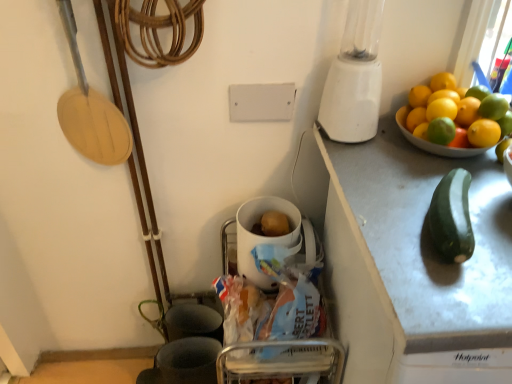
What are the coordinates of `yellow matte lemon at upper right, the fourth lemon when ordered from top to bottom` in the screenshot? It's located at (441, 109).

How much space does green matte lemon at upper right, which appears as the 1th lemon when ordered from the bottom, occupy vertically?

green matte lemon at upper right, which appears as the 1th lemon when ordered from the bottom, is 1.82 inches in height.

The image size is (512, 384). I want to click on green matte lemon at upper right, which appears as the 1th lemon when ordered from the bottom, so click(441, 131).

At what (x,y) coordinates should I click in order to perform the action: click on yellow matte lemon at upper right, the fourth lemon when ordered from top to bottom. Please return your answer as a coordinate pair (x, y). Looking at the image, I should click on (441, 109).

Is wooden at left far from white glossy mug at center?

No.

This screenshot has height=384, width=512. I want to click on pot/pan lying above the white glossy mug at center (from the image's perspective), so click(x=90, y=110).

Does wooden at left turn towards white glossy mug at center?

No, wooden at left is not oriented towards white glossy mug at center.

Would you consider yellow matte lemon at upper right, arranged as the first lemon when viewed from the top, to be distant from white plastic blender at upper right?

No, there isn't a large distance between yellow matte lemon at upper right, arranged as the first lemon when viewed from the top, and white plastic blender at upper right.

Between point (447, 82) and point (353, 57), which one is positioned behind?

The point (447, 82) is behind.

From the image's perspective, relative to white plastic blender at upper right, is yellow matte lemon at upper right, arranged as the first lemon when viewed from the top, above or below?

Based on their image positions, yellow matte lemon at upper right, arranged as the first lemon when viewed from the top, is located beneath white plastic blender at upper right.

In the image, there is a yellow matte lemon at upper right, the sixth lemon positioned from the bottom. Identify the location of blender above it (from the image's perspective). Image resolution: width=512 pixels, height=384 pixels. (354, 77).

Which is correct: yellow matte lemon at right, which is the fifth lemon from top to bottom, is inside yellow matte lemon at upper right, the fourth lemon when ordered from top to bottom, or outside of it?

yellow matte lemon at right, which is the fifth lemon from top to bottom, lies outside yellow matte lemon at upper right, the fourth lemon when ordered from top to bottom.

Is yellow matte lemon at right, the second lemon from the bottom, in front of or behind yellow matte lemon at upper right, the 3th lemon ordered from the bottom, in the image?

yellow matte lemon at right, the second lemon from the bottom, is in front of yellow matte lemon at upper right, the 3th lemon ordered from the bottom.

Based on their positions, is white plastic blender at upper right located to the left or right of yellow matte lemon at upper right, the 3th lemon viewed from the top?

Based on their positions, white plastic blender at upper right is located to the left of yellow matte lemon at upper right, the 3th lemon viewed from the top.

Is white plastic blender at upper right taller than yellow matte lemon at upper right, acting as the 4th lemon starting from the bottom?

Correct, white plastic blender at upper right is much taller as yellow matte lemon at upper right, acting as the 4th lemon starting from the bottom.

Is white plastic blender at upper right completely or partially outside of yellow matte lemon at upper right, acting as the 4th lemon starting from the bottom?

white plastic blender at upper right is positioned outside yellow matte lemon at upper right, acting as the 4th lemon starting from the bottom.

Between white plastic blender at upper right and yellow matte lemon at upper right, the 3th lemon viewed from the top, which one is positioned in front?

white plastic blender at upper right is more forward.

From a real-world perspective, which lemon is the 3rd one above the yellow matte lemon at right, the second lemon from the bottom? Please provide its 2D coordinates.

[(444, 95)]

Is the position of yellow matte lemon at upper right, which is the second lemon from top to bottom, less distant than that of yellow matte lemon at right, the second lemon from the bottom?

No, yellow matte lemon at upper right, which is the second lemon from top to bottom, is further to the viewer.

Could yellow matte lemon at right, the second lemon from the bottom, be considered to be inside yellow matte lemon at upper right, which is the second lemon from top to bottom?

Actually, yellow matte lemon at right, the second lemon from the bottom, is outside yellow matte lemon at upper right, which is the second lemon from top to bottom.

Between yellow matte lemon at upper right, which is the second lemon from top to bottom, and yellow matte lemon at right, the second lemon from the bottom, which one has smaller width?

With smaller width is yellow matte lemon at right, the second lemon from the bottom.

Does white plastic blender at upper right appear on the right side of white ceramic bowl at upper right?

Incorrect, white plastic blender at upper right is not on the right side of white ceramic bowl at upper right.

What's the angular difference between white plastic blender at upper right and white ceramic bowl at upper right's facing directions?

The angle between the facing direction of white plastic blender at upper right and the facing direction of white ceramic bowl at upper right is 0.879 degrees.

From the image's perspective, is white plastic blender at upper right on white ceramic bowl at upper right?

Correct, white plastic blender at upper right appears higher than white ceramic bowl at upper right in the image.

From a real-world perspective, between white plastic blender at upper right and white ceramic bowl at upper right, who is vertically lower?

white ceramic bowl at upper right.

Between green matte lemon at upper right, the 6th lemon viewed from the top, and white glossy mug at center, which one has larger size?

Bigger between the two is white glossy mug at center.

Which object is wider, green matte lemon at upper right, the 6th lemon viewed from the top, or white glossy mug at center?

white glossy mug at center is wider.

Locate an element on the screen. Image resolution: width=512 pixels, height=384 pixels. coffee cup behind the green matte lemon at upper right, which appears as the 1th lemon when ordered from the bottom is located at coordinates (264, 236).

From a real-world perspective, who is located higher, green matte lemon at upper right, the 6th lemon viewed from the top, or white glossy mug at center?

In real-world perspective, green matte lemon at upper right, the 6th lemon viewed from the top, is above.

Where is `pot/pan located above the white glossy mug at center (from the image's perspective)`? This screenshot has height=384, width=512. pot/pan located above the white glossy mug at center (from the image's perspective) is located at coordinates (90, 110).

This screenshot has height=384, width=512. Identify the location of blender on the left of the yellow matte lemon at upper right, arranged as the first lemon when viewed from the top. (354, 77).

Based on their spatial positions, is orange matte at upper right or green matte zucchini at right further from green matte lemon at upper right, the 6th lemon viewed from the top?

orange matte at upper right lies further to green matte lemon at upper right, the 6th lemon viewed from the top, than the other object.

When comparing their distances from orange matte at upper right, does green matte zucchini at right or yellow matte lemon at upper right, the sixth lemon positioned from the bottom, seem further?

Based on the image, green matte zucchini at right appears to be further to orange matte at upper right.

Which object lies further to the anchor point wooden at left, orange matte at upper right or green matte zucchini at right?

orange matte at upper right.

Consider the image. When comparing their distances from white ceramic bowl at upper right, does yellow matte lemon at upper right, arranged as the first lemon when viewed from the top, or yellow matte lemon at upper right, the 3th lemon ordered from the bottom, seem further?

Among the two, yellow matte lemon at upper right, arranged as the first lemon when viewed from the top, is located further to white ceramic bowl at upper right.

Looking at the image, which one is located closer to white ceramic bowl at upper right, yellow matte lemon at right, the second lemon from the bottom, or yellow matte lemon at upper right, acting as the 4th lemon starting from the bottom?

Among the two, yellow matte lemon at right, the second lemon from the bottom, is located nearer to white ceramic bowl at upper right.

Looking at the image, which one is located further to wooden at left, yellow matte lemon at upper right, the 3th lemon ordered from the bottom, or green matte lemon at upper right, the 6th lemon viewed from the top?

Based on the image, yellow matte lemon at upper right, the 3th lemon ordered from the bottom, appears to be further to wooden at left.

Estimate the real-world distances between objects in this image. Which object is further from white glossy mug at center, yellow matte lemon at upper right, the sixth lemon positioned from the bottom, or white ceramic bowl at upper right?

yellow matte lemon at upper right, the sixth lemon positioned from the bottom.

Based on their spatial positions, is green matte zucchini at right or green matte lemon at upper right, the 6th lemon viewed from the top, closer to yellow matte lemon at upper right, the sixth lemon positioned from the bottom?

green matte lemon at upper right, the 6th lemon viewed from the top, is positioned closer to the anchor yellow matte lemon at upper right, the sixth lemon positioned from the bottom.

Locate an element on the screen. The height and width of the screenshot is (384, 512). lemon situated between wooden at left and yellow matte lemon at upper right, the 3th lemon ordered from the bottom, from left to right is located at coordinates (441, 131).

Where is `bowl positioned between green matte lemon at upper right, the 6th lemon viewed from the top, and orange matte at upper right from near to far`? This screenshot has height=384, width=512. bowl positioned between green matte lemon at upper right, the 6th lemon viewed from the top, and orange matte at upper right from near to far is located at coordinates (434, 143).

Image resolution: width=512 pixels, height=384 pixels. Find the location of `blender between white glossy mug at center and green matte zucchini at right in the horizontal direction`. blender between white glossy mug at center and green matte zucchini at right in the horizontal direction is located at coordinates [x=354, y=77].

Locate an element on the screen. Image resolution: width=512 pixels, height=384 pixels. fruit between yellow matte lemon at upper right, the 3th lemon viewed from the top, and yellow matte lemon at right, the second lemon from the bottom, in the vertical direction is located at coordinates (494, 106).